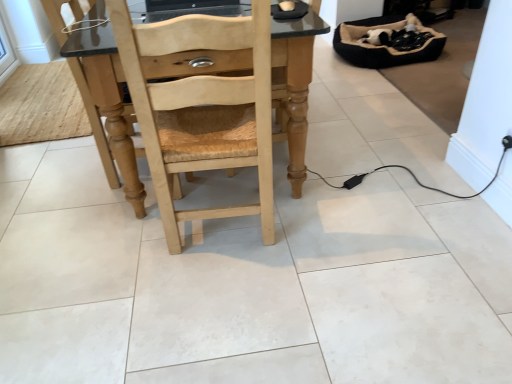
At what (x,y) coordinates should I click in order to perform the action: click on vacant area situated below natural wood chair at center (from a real-world perspective). Please return your answer as a coordinate pair (x, y). Image resolution: width=512 pixels, height=384 pixels. Looking at the image, I should click on (228, 236).